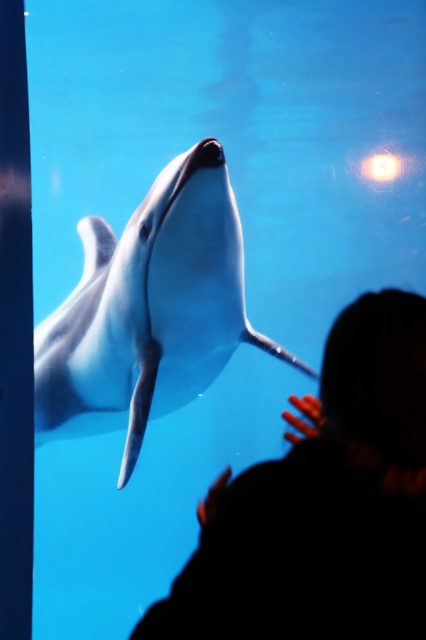
Can you confirm if silhouette hair at upper center is positioned to the right of white smooth dolphin at center?

Indeed, silhouette hair at upper center is positioned on the right side of white smooth dolphin at center.

You are a GUI agent. You are given a task and a screenshot of the screen. Output one action in this format:
    pyautogui.click(x=<x>, y=<y>)
    Task: Click on the silhouette hair at upper center
    Image resolution: width=426 pixels, height=640 pixels.
    Given the screenshot: What is the action you would take?
    pyautogui.click(x=324, y=504)

Is point (264, 596) farther from viewer compared to point (114, 291)?

That is False.

Where is `silhouette hair at upper center`? silhouette hair at upper center is located at coordinates (324, 504).